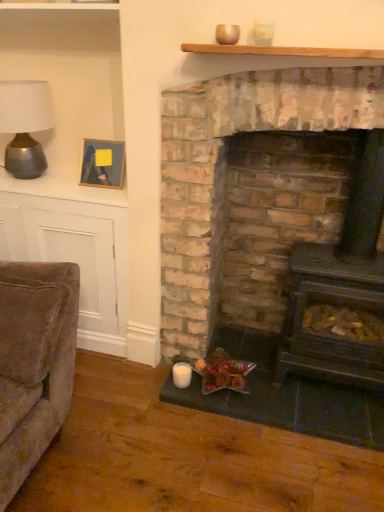
Question: Considering the relative sizes of shiny brown nuts at lower center and wooden picture frame at upper left in the image provided, is shiny brown nuts at lower center thinner than wooden picture frame at upper left?

Choices:
 (A) yes
 (B) no

Answer: (B)

Question: From a real-world perspective, is shiny brown nuts at lower center physically above wooden picture frame at upper left?

Choices:
 (A) yes
 (B) no

Answer: (B)

Question: From the image's perspective, is shiny brown nuts at lower center on top of wooden picture frame at upper left?

Choices:
 (A) no
 (B) yes

Answer: (A)

Question: Is shiny brown nuts at lower center placed right next to wooden picture frame at upper left?

Choices:
 (A) yes
 (B) no

Answer: (B)

Question: Is shiny brown nuts at lower center wider than wooden picture frame at upper left?

Choices:
 (A) yes
 (B) no

Answer: (A)

Question: Does shiny brown nuts at lower center have a lesser height compared to wooden picture frame at upper left?

Choices:
 (A) no
 (B) yes

Answer: (B)

Question: Does wooden mantle at upper center appear on the right side of shiny brown nuts at lower center?

Choices:
 (A) yes
 (B) no

Answer: (A)

Question: Can you confirm if wooden mantle at upper center is positioned to the left of shiny brown nuts at lower center?

Choices:
 (A) yes
 (B) no

Answer: (B)

Question: Does wooden mantle at upper center have a smaller size compared to shiny brown nuts at lower center?

Choices:
 (A) no
 (B) yes

Answer: (B)

Question: Can you confirm if wooden mantle at upper center is shorter than shiny brown nuts at lower center?

Choices:
 (A) no
 (B) yes

Answer: (B)

Question: Is wooden mantle at upper center thinner than shiny brown nuts at lower center?

Choices:
 (A) no
 (B) yes

Answer: (B)

Question: Considering the relative sizes of wooden mantle at upper center and shiny brown nuts at lower center in the image provided, is wooden mantle at upper center taller than shiny brown nuts at lower center?

Choices:
 (A) yes
 (B) no

Answer: (B)

Question: Is dark gray cast iron wood burning stove at center closer to camera compared to brick fireplace at center?

Choices:
 (A) no
 (B) yes

Answer: (A)